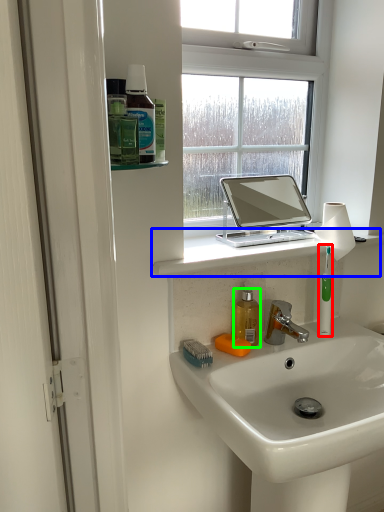
Question: Considering the real-world distances, which object is closest to toothbrush (highlighted by a red box)? window sill (highlighted by a blue box) or mouthwash (highlighted by a green box).

Choices:
 (A) window sill
 (B) mouthwash

Answer: (B)